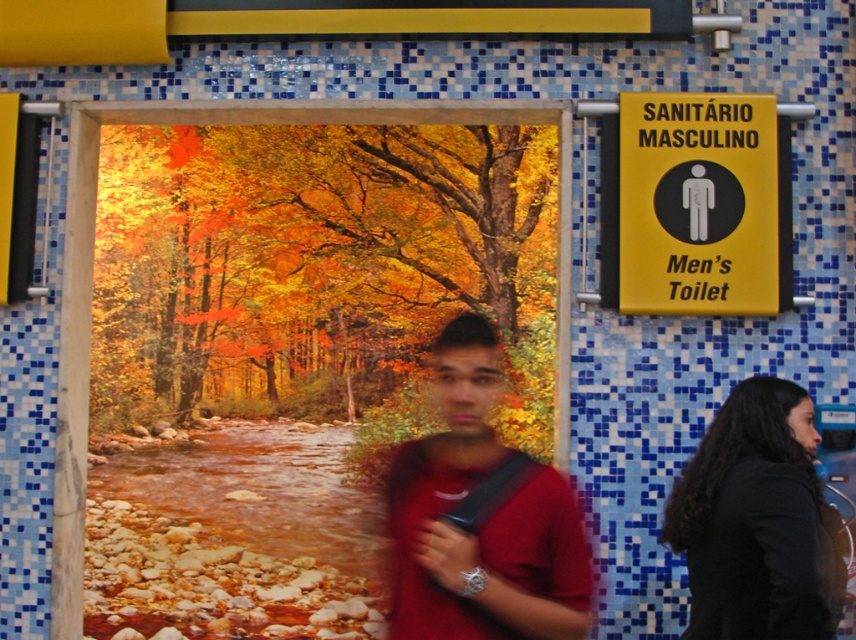
Is matte red shirt at center shorter than yellow paper sign at upper right?

Correct, matte red shirt at center is not as tall as yellow paper sign at upper right.

Does matte red shirt at center have a greater height compared to yellow paper sign at upper right?

In fact, matte red shirt at center may be shorter than yellow paper sign at upper right.

Does point (397, 449) lie behind point (770, 285)?

No, (397, 449) is in front of (770, 285).

The height and width of the screenshot is (640, 856). I want to click on matte red shirt at center, so click(480, 516).

Does yellow paper sign at upper right lie in front of black fabric at right?

No, it is not.

Is yellow paper sign at upper right to the left of black fabric at right from the viewer's perspective?

In fact, yellow paper sign at upper right is to the right of black fabric at right.

Identify the location of yellow paper sign at upper right. (700, 204).

Describe the element at coordinates (480, 516) in the screenshot. This screenshot has height=640, width=856. I see `matte red shirt at center` at that location.

Is matte red shirt at center behind black fabric at right?

No, it is in front of black fabric at right.

This screenshot has width=856, height=640. Identify the location of matte red shirt at center. (480, 516).

Image resolution: width=856 pixels, height=640 pixels. What are the coordinates of `matte red shirt at center` in the screenshot? It's located at click(x=480, y=516).